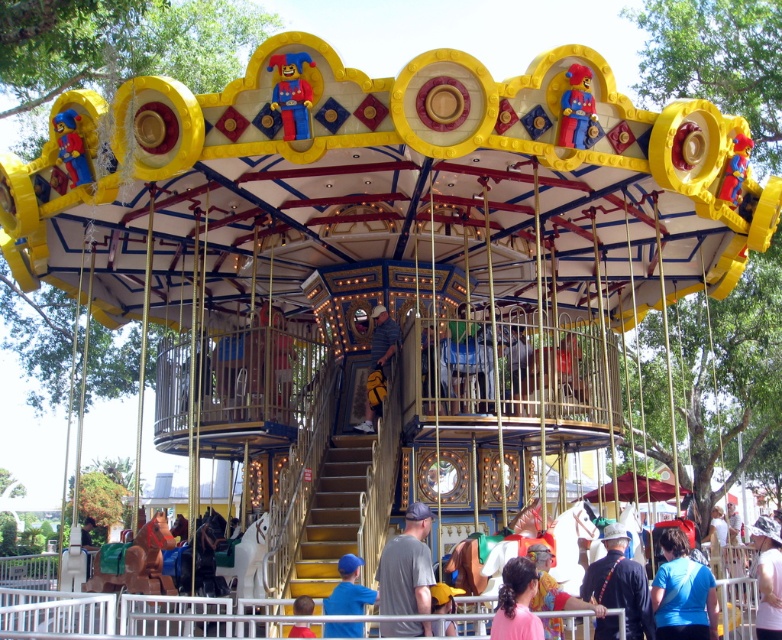
You are a visitor at the carousel and notice two items at the center of the scene. Which item is closer to the ground between the gray cotton shirt at center and the yellow fabric bag at center?

The gray cotton shirt at center is closer to the ground because it is positioned under the yellow fabric bag at center.

You are standing in front of the carousel and notice two shirts displayed on mannequins. The gray cotton shirt at center and the blue fabric shirt at lower center. Which shirt is taller?

The gray cotton shirt at center is much taller than the blue fabric shirt at lower center.

You are standing in front of the carousel and want to know how far the point at coordinates (671, 612) is from you. Can you determine the distance?

The point at coordinates (671, 612) is 131.93 feet away from the viewer.